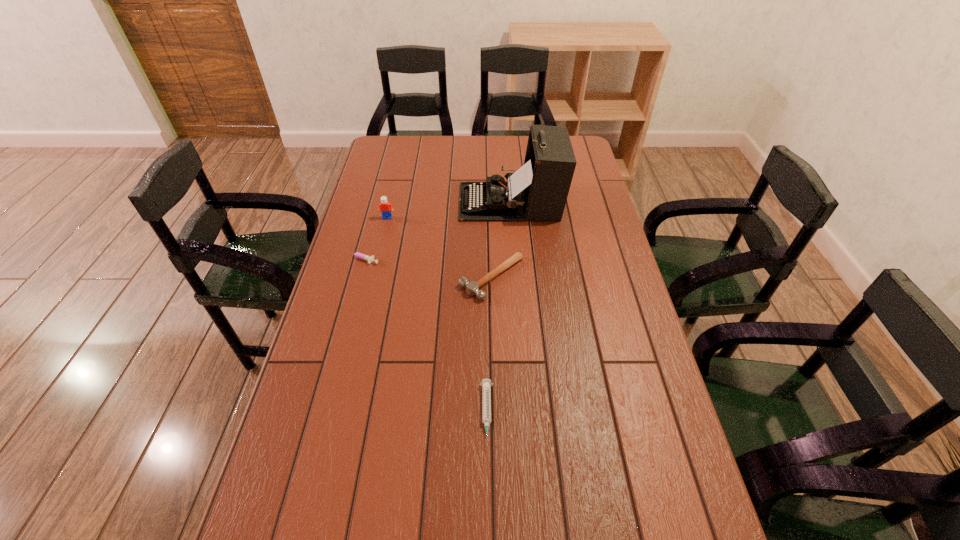
Identify which object is the nearest to the third tallest object. Please provide its 2D coordinates. Your answer should be formatted as a tuple, i.e. [(x, y)], where the tuple contains the x and y coordinates of a point satisfying the conditions above.

[(538, 190)]

Identify which object is located as the second nearest to the nearest object. Please provide its 2D coordinates. Your answer should be formatted as a tuple, i.e. [(x, y)], where the tuple contains the x and y coordinates of a point satisfying the conditions above.

[(358, 255)]

Locate an element on the screen. This screenshot has height=540, width=960. vacant space that satisfies the following two spatial constraints: 1. inside the open case of the typewriter; 2. at the needle end of the nearer syringe is located at coordinates (527, 414).

This screenshot has height=540, width=960. Identify the location of free region that satisfies the following two spatial constraints: 1. inside the open case of the tallest object; 2. at the needle end of the right syringe. (527, 414).

The image size is (960, 540). In order to click on vacant space that satisfies the following two spatial constraints: 1. inside the open case of the tallest object; 2. on the face of the fourth shortest object in this screenshot , I will do `click(512, 218)`.